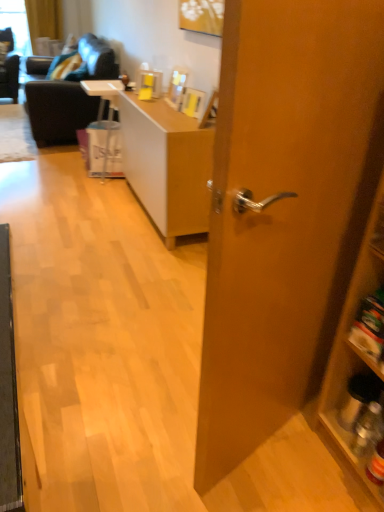
Question: Is point (104, 156) closer or farther from the camera than point (76, 58)?

Choices:
 (A) closer
 (B) farther

Answer: (A)

Question: From the image's perspective, is white plastic bag at center positioned above or below velvet green pillow at upper left?

Choices:
 (A) below
 (B) above

Answer: (A)

Question: Estimate the real-world distances between objects in this image. Which object is farther from the wooden cabinet at right?

Choices:
 (A) dark gray fabric couch at upper left
 (B) light brown wood desk at center
 (C) wooden door at center
 (D) white plastic bag at center
 (E) velvet green pillow at upper left

Answer: (E)

Question: Which of these objects is positioned farthest from the dark gray fabric couch at upper left?

Choices:
 (A) wooden door at center
 (B) wooden cabinet at right
 (C) light brown wood desk at center
 (D) velvet green pillow at upper left
 (E) white plastic bag at center

Answer: (B)